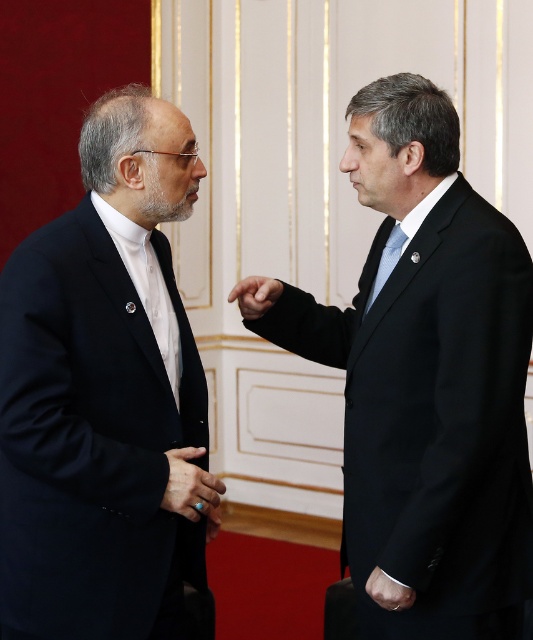
You are a security camera positioned at the viewer location. You need to determine if the matte black hand at center is within the 6 feet social distancing guideline. Can you confirm?

The matte black hand at center and viewer are 5.59 feet apart from each other, which is within the 6 feet social distancing guideline.

You are an interior designer analyzing the positioning of objects in the scene. The matte black suit at left is placed at coordinates 0.616 on the x and 0.191 on the y. How would you describe its position relative to the center of the image?

The matte black suit at left is positioned to the left and lower part of the image since its x coordinate is 0.616 and y coordinate is 0.191, which places it closer to the left edge and lower portion compared to the center.